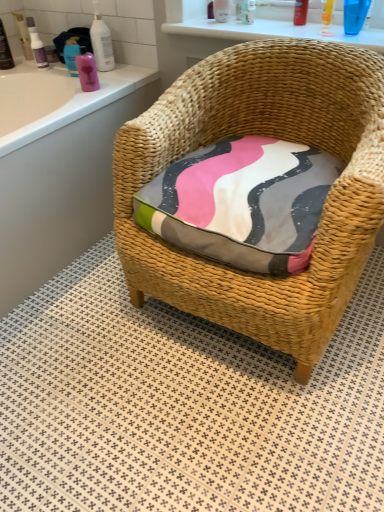
Where is `free spot in front of white glossy bottle at upper left, the sixth toiletry viewed from the left`? free spot in front of white glossy bottle at upper left, the sixth toiletry viewed from the left is located at coordinates (111, 77).